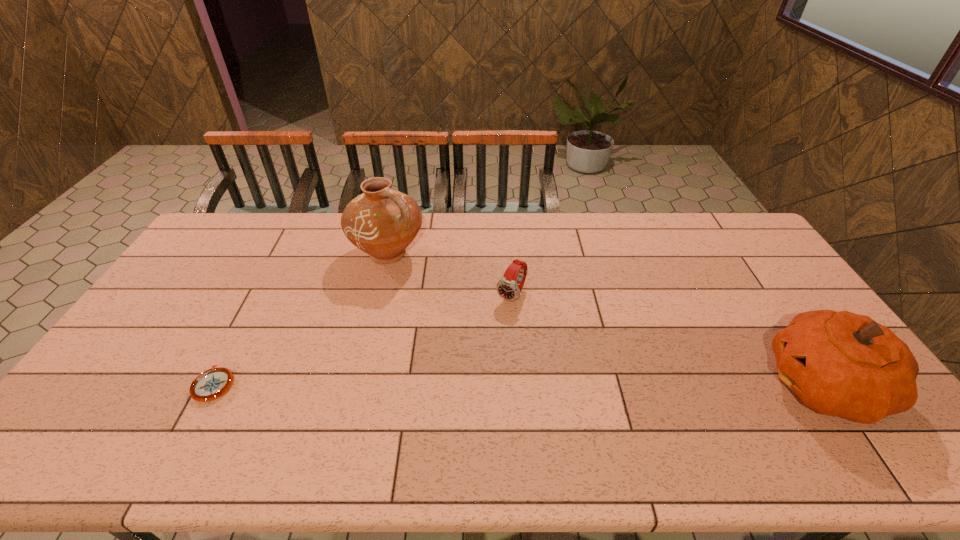
You are a GUI agent. You are given a task and a screenshot of the screen. Output one action in this format:
    pyautogui.click(x=<x>, y=<y>)
    Task: Click on the vacant space that's between the compass and the tallest object
    Image resolution: width=960 pixels, height=540 pixels.
    Given the screenshot: What is the action you would take?
    pyautogui.click(x=301, y=319)

Where is `free space between the tallest object and the rightmost object`? The width and height of the screenshot is (960, 540). free space between the tallest object and the rightmost object is located at coordinates (606, 319).

Find the location of a particular element. This screenshot has height=540, width=960. free spot between the leftmost object and the third object from left to right is located at coordinates (363, 340).

Identify the location of free space between the watch and the third object from right to left. Image resolution: width=960 pixels, height=540 pixels. (450, 274).

Locate an element on the screen. The height and width of the screenshot is (540, 960). free space that is in between the compass and the pumpkin is located at coordinates (519, 384).

Locate an element on the screen. The height and width of the screenshot is (540, 960). unoccupied position between the second object from left to right and the shortest object is located at coordinates (301, 319).

At what (x,y) coordinates should I click in order to perform the action: click on free space between the watch and the shortest object. Please return your answer as a coordinate pair (x, y). This screenshot has height=540, width=960. Looking at the image, I should click on (363, 340).

This screenshot has height=540, width=960. Find the location of `vacant region between the second object from right to left and the pottery`. vacant region between the second object from right to left and the pottery is located at coordinates (450, 274).

Find the location of a particular element. The image size is (960, 540). unoccupied area between the tallest object and the second shortest object is located at coordinates (450, 274).

Find the location of a particular element. This screenshot has height=540, width=960. object identified as the second closest to the tallest object is located at coordinates (213, 383).